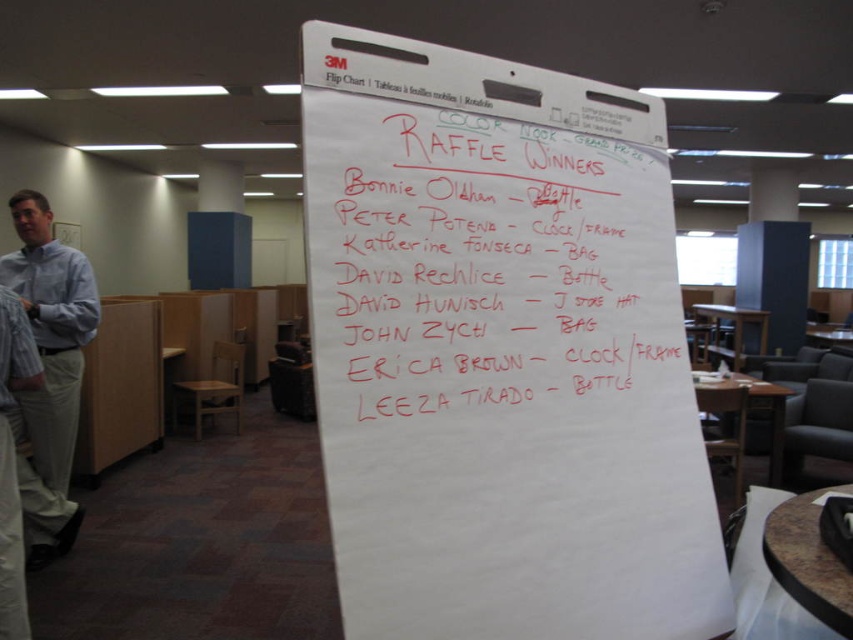
You are organizing a presentation and need to check if there is enough space on the whiteboard for an additional large chart. You see the white marker text at center and the blue striped shirt at left. Which object takes up more space on the whiteboard?

The blue striped shirt at left takes up more space on the whiteboard than the white marker text at center, as the white marker text at center occupies less space than blue striped shirt at left.

You are a delivery person who needs to place a package on the desk. The desk is located between the white marker text at center and the blue striped shirt at left. Can you fit the package that is 2 meters long on the desk?

The distance between the white marker text at center and blue striped shirt at left is 1.93 meters, so the desk is only 1.93 meters long. The package is 2 meters long, which is longer than the desk. Therefore, the package cannot be placed on the desk.

You are an event organizer checking the whiteboard for the raffle winners. You notice the white marker text at center and the blue striped shirt at left. Which object is taller?

The blue striped shirt at left is taller because the white marker text at center is shorter than it.